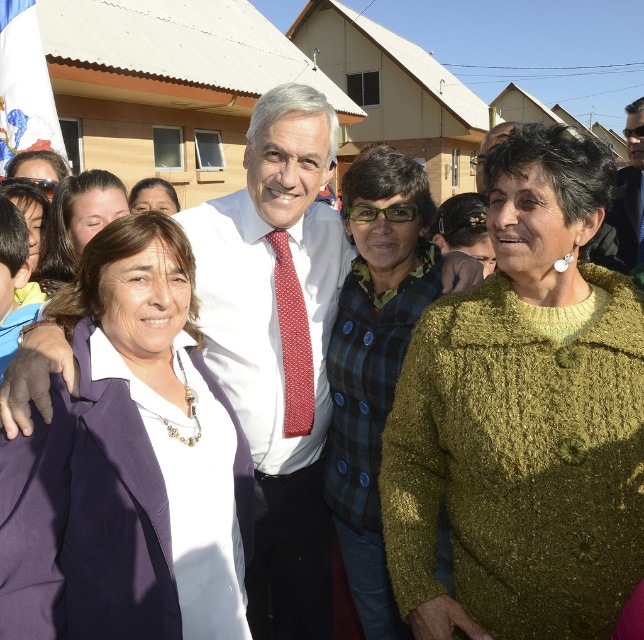
Question: Among these points, which one is nearest to the camera?

Choices:
 (A) coord(374,164)
 (B) coord(153,189)
 (C) coord(437,328)

Answer: (C)

Question: From the image, what is the correct spatial relationship of knitted olive-green sweater at center in relation to matte black hair at upper left?

Choices:
 (A) below
 (B) above

Answer: (A)

Question: Which point is closer to the camera?

Choices:
 (A) matte green sweater at center
 (B) purple fabric jacket at left
 (C) green textured sweater at center

Answer: (B)

Question: Can you confirm if green textured sweater at center is positioned to the right of matte black hair at upper left?

Choices:
 (A) yes
 (B) no

Answer: (A)

Question: Does purple fabric jacket at left have a lesser width compared to matte black hair at upper left?

Choices:
 (A) yes
 (B) no

Answer: (B)

Question: Which object is positioned farthest from the matte black hair at upper left?

Choices:
 (A) knitted olive-green sweater at center
 (B) white shirt at center
 (C) matte green sweater at center

Answer: (A)